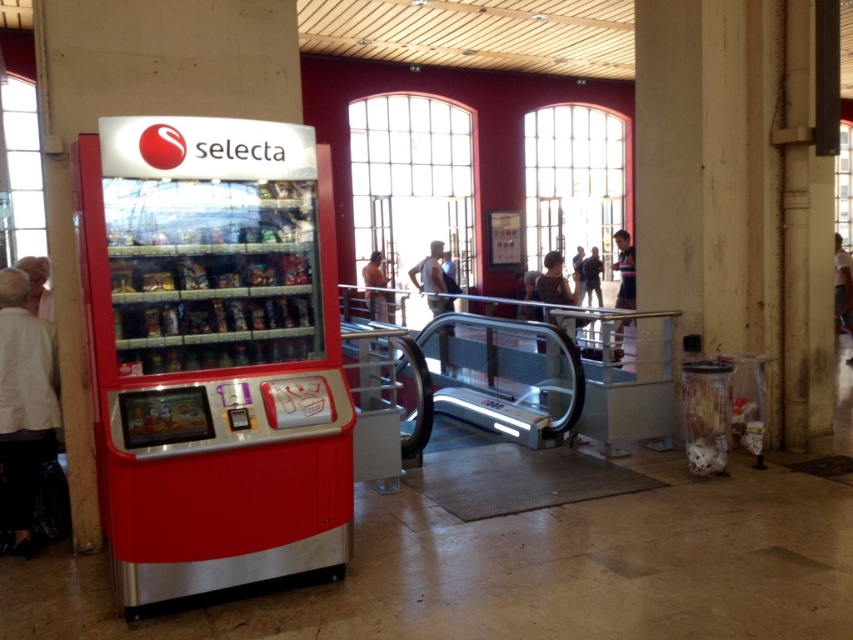
Does point (44, 280) lie in front of point (846, 256)?

Yes, point (44, 280) is closer to viewer.

Between white fabric person at left and smooth skin person at center, which one has more height?

smooth skin person at center is taller.

Between point (36, 292) and point (850, 320), which one is positioned in front?

Point (36, 292) is more forward.

Find the location of a particular element. The height and width of the screenshot is (640, 853). white fabric person at left is located at coordinates (38, 285).

Is point (837, 236) positioned in front of point (375, 296)?

Yes, it is.

Which is more to the left, smooth skin person at center or brown leather jacket at upper center?

brown leather jacket at upper center

Is point (846, 257) positioned in front of point (364, 298)?

Yes, point (846, 257) is in front of point (364, 298).

Where is `smooth skin person at center`? smooth skin person at center is located at coordinates (842, 284).

Where is `white fabric jacket at left`? Image resolution: width=853 pixels, height=640 pixels. white fabric jacket at left is located at coordinates (24, 404).

Who is more forward, (28, 378) or (573, 268)?

Point (28, 378) is more forward.

Find the location of a particular element. white fabric jacket at left is located at coordinates (24, 404).

The height and width of the screenshot is (640, 853). I want to click on white fabric jacket at left, so click(24, 404).